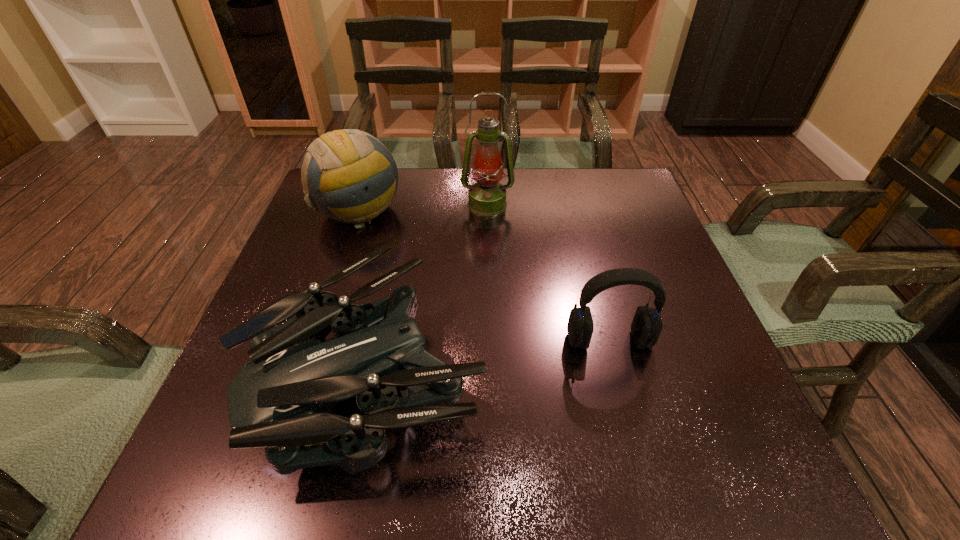
At what (x,y) coordinates should I click in order to perform the action: click on volleyball positioned at the far edge. Please return your answer as a coordinate pair (x, y). Looking at the image, I should click on (348, 175).

I want to click on object at the near edge, so click(x=282, y=399).

Locate an element on the screen. The image size is (960, 540). volleyball situated at the left edge is located at coordinates (348, 175).

At what (x,y) coordinates should I click in order to perform the action: click on drone that is at the left edge. Please return your answer as a coordinate pair (x, y). Looking at the image, I should click on (282, 399).

Find the location of a particular element. The image size is (960, 540). object at the right edge is located at coordinates (646, 327).

You are a GUI agent. You are given a task and a screenshot of the screen. Output one action in this format:
    pyautogui.click(x=<x>, y=<y>)
    Task: Click on the object at the far left corner
    The width and height of the screenshot is (960, 540).
    Given the screenshot: What is the action you would take?
    pyautogui.click(x=348, y=175)

The width and height of the screenshot is (960, 540). Identify the location of object present at the near left corner. (282, 399).

Where is `vacant space at the far edge of the desktop`? The height and width of the screenshot is (540, 960). vacant space at the far edge of the desktop is located at coordinates (581, 214).

The image size is (960, 540). What are the coordinates of `vacant space at the near edge` in the screenshot? It's located at (469, 446).

In the image, there is a desktop. Identify the location of vacant space at the left edge. This screenshot has width=960, height=540. (300, 278).